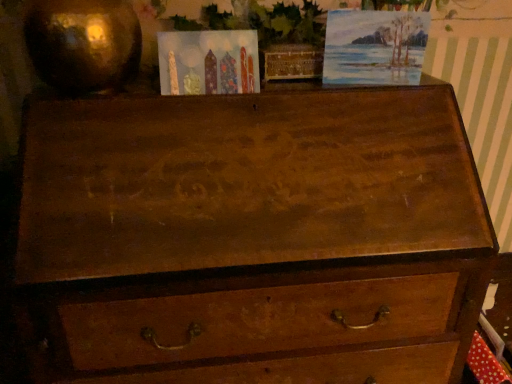
Question: Based on their positions, is watercolor paper painting at upper right located to the left or right of matte paper postcard at upper center?

Choices:
 (A) right
 (B) left

Answer: (A)

Question: Is watercolor paper painting at upper right in front of or behind matte paper postcard at upper center in the image?

Choices:
 (A) front
 (B) behind

Answer: (B)

Question: Is watercolor paper painting at upper right inside the boundaries of matte paper postcard at upper center, or outside?

Choices:
 (A) outside
 (B) inside

Answer: (A)

Question: Is matte paper postcard at upper center taller or shorter than watercolor paper painting at upper right?

Choices:
 (A) tall
 (B) short

Answer: (B)

Question: From the image's perspective, is matte paper postcard at upper center located above or below watercolor paper painting at upper right?

Choices:
 (A) below
 (B) above

Answer: (A)

Question: Is matte paper postcard at upper center wider or thinner than watercolor paper painting at upper right?

Choices:
 (A) thin
 (B) wide

Answer: (B)

Question: Choose the correct answer: Is matte paper postcard at upper center inside watercolor paper painting at upper right or outside it?

Choices:
 (A) inside
 (B) outside

Answer: (B)